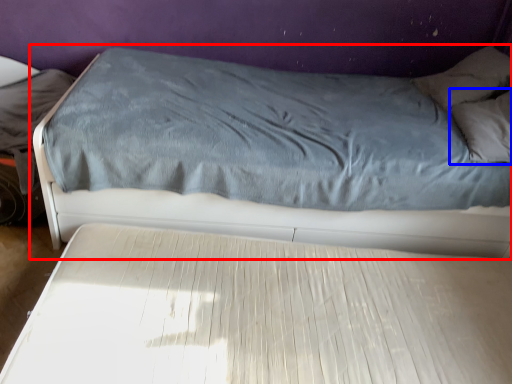
Question: Which of the following is the farthest to the observer, bed (highlighted by a red box) or pillow (highlighted by a blue box)?

Choices:
 (A) bed
 (B) pillow

Answer: (B)